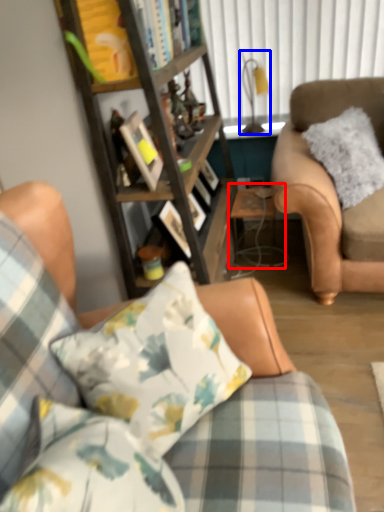
Question: Which object appears closest to the camera in this image, table (highlighted by a red box) or lamp (highlighted by a blue box)?

Choices:
 (A) table
 (B) lamp

Answer: (A)